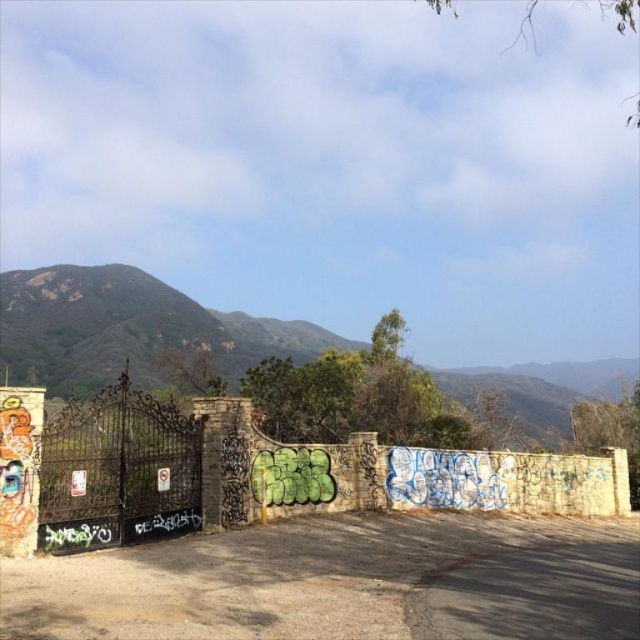
Question: Where is stone textured wall at center located in relation to black wrought iron gate at center in the image?

Choices:
 (A) left
 (B) right

Answer: (B)

Question: Is stone textured wall at center thinner than black wrought iron gate at center?

Choices:
 (A) no
 (B) yes

Answer: (A)

Question: Observing the image, what is the correct spatial positioning of stone textured wall at center in reference to black wrought iron gate at center?

Choices:
 (A) left
 (B) right

Answer: (B)